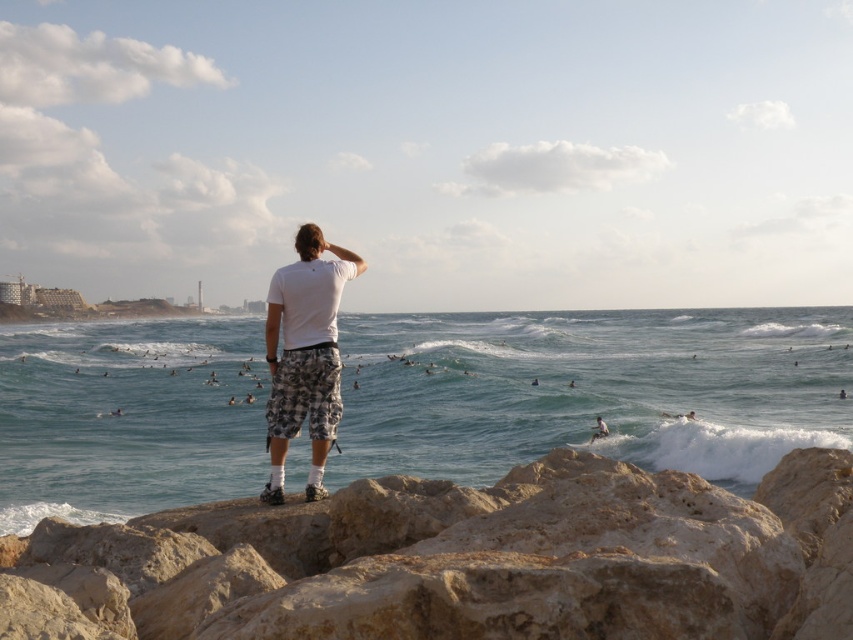
Between clear blue water at center and beige rock at center, which one appears on the left side from the viewer's perspective?

beige rock at center

Does clear blue water at center have a smaller size compared to beige rock at center?

Incorrect, clear blue water at center is not smaller in size than beige rock at center.

Does point (109, 497) come in front of point (659, 632)?

No, (109, 497) is further to viewer.

The width and height of the screenshot is (853, 640). Find the location of `clear blue water at center`. clear blue water at center is located at coordinates (590, 388).

Between point (785, 481) and point (306, 404), which one is positioned behind?

The point (306, 404) is more distant.

Consider the image. Measure the distance from beige rock at center to white cotton t-shirt at center.

beige rock at center and white cotton t-shirt at center are 2.96 meters apart from each other.

You are a GUI agent. You are given a task and a screenshot of the screen. Output one action in this format:
    pyautogui.click(x=<x>, y=<y>)
    Task: Click on the beige rock at center
    The image size is (853, 640).
    Given the screenshot: What is the action you would take?
    pyautogui.click(x=460, y=561)

Consider the image. Who is shorter, clear blue water at center or white cotton t-shirt at center?

Standing shorter between the two is white cotton t-shirt at center.

Who is more distant from viewer, (231, 472) or (329, 260)?

Point (231, 472)

Between point (230, 372) and point (299, 387), which one is positioned behind?

Positioned behind is point (230, 372).

Identify the location of clear blue water at center. (590, 388).